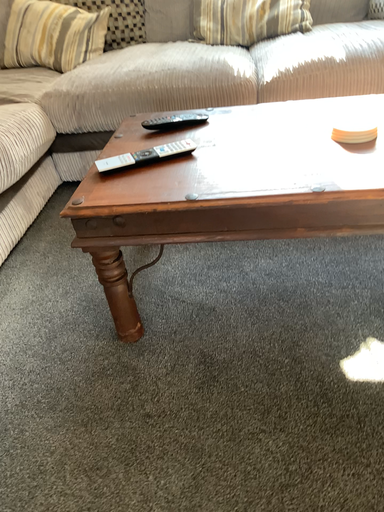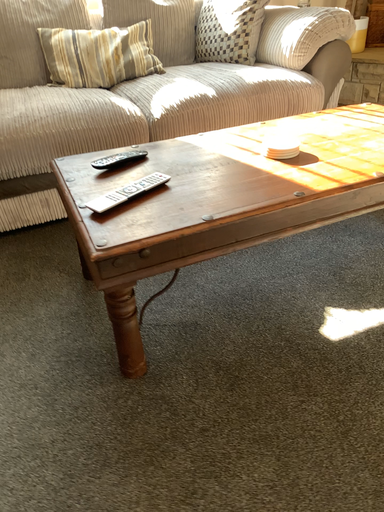
Question: Which way did the camera rotate in the video?

Choices:
 (A) rotated right
 (B) rotated left

Answer: (A)